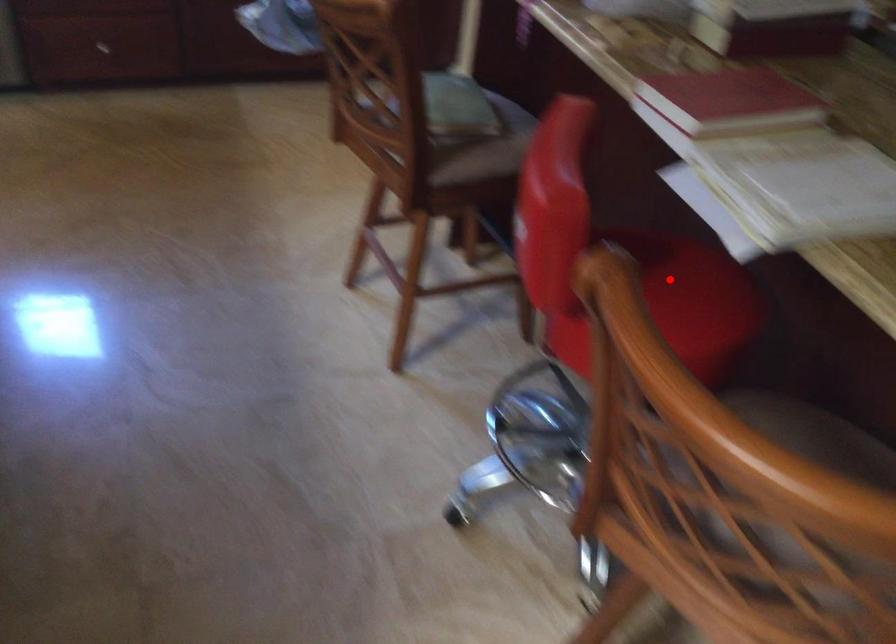
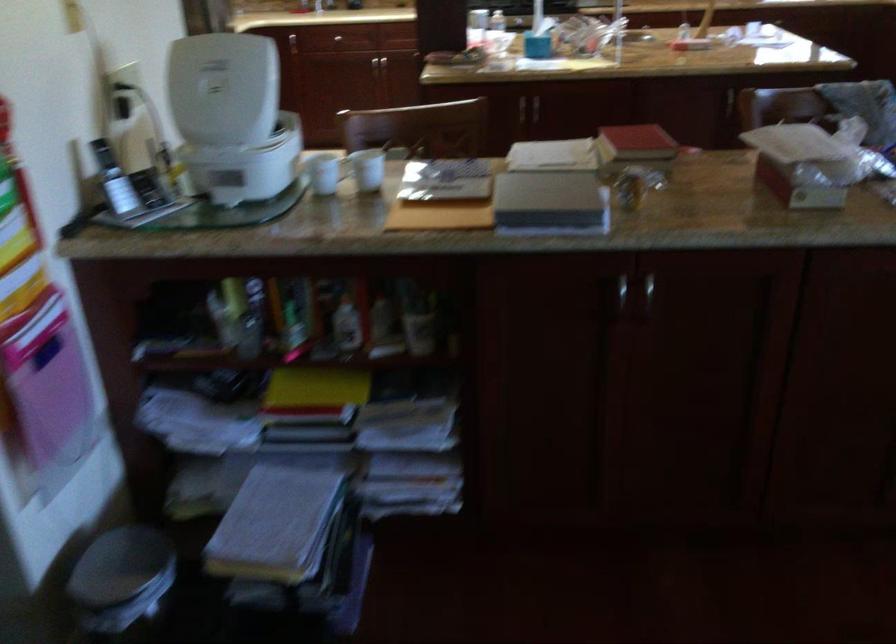
Question: I am providing you with two images of the same scene from different viewpoints. A red point is marked on the first image. At the location where the point appears in image 1, is it still visible in image 2?

Choices:
 (A) Yes
 (B) No

Answer: (B)